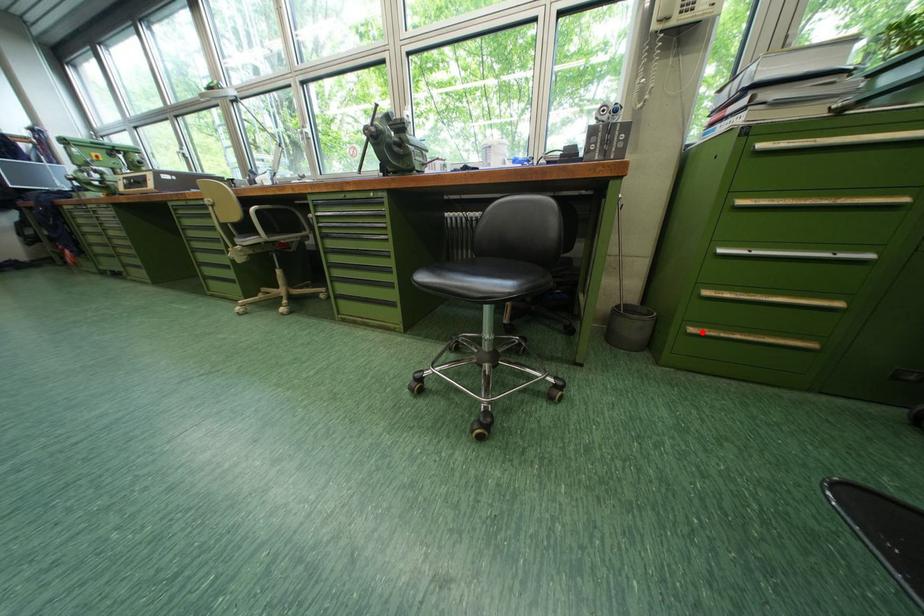
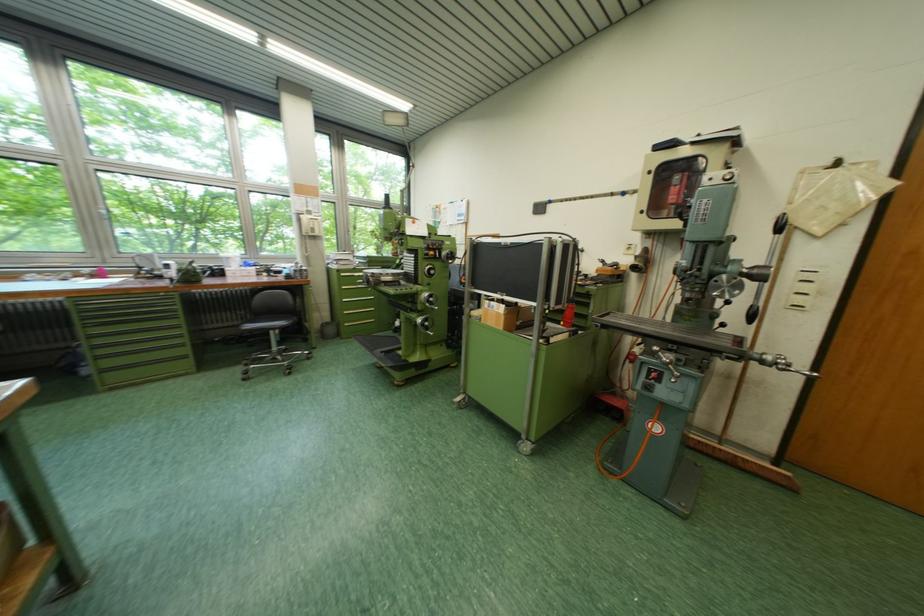
Find the pixel in the second image that matches the highlighted location in the first image.

(357, 326)